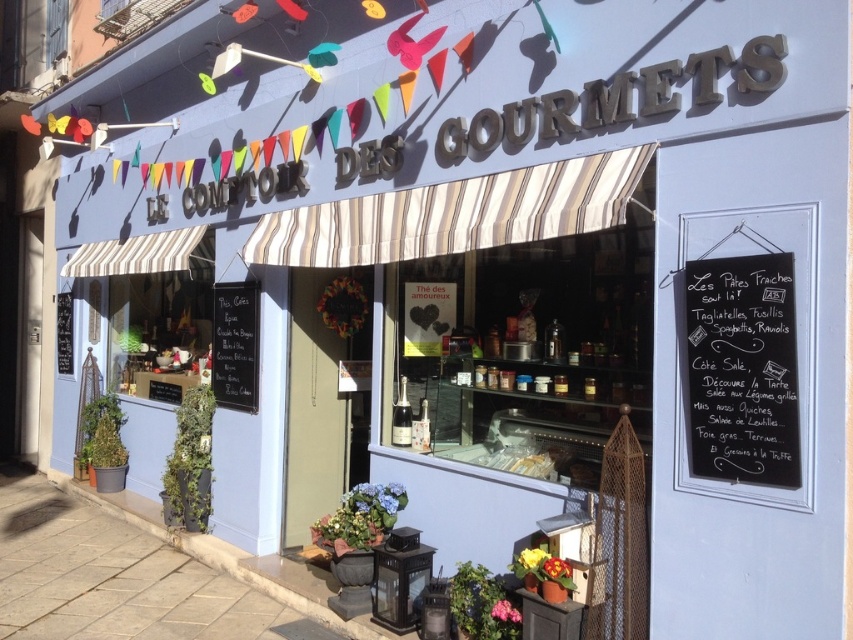
Is point (146, 563) closer to camera compared to point (723, 474)?

No, (146, 563) is further to viewer.

Which is more to the left, sandy beige paving stone at lower left or black chalkboard at upper right?

sandy beige paving stone at lower left is more to the left.

Between point (113, 605) and point (743, 284), which one is positioned behind?

Positioned behind is point (113, 605).

This screenshot has height=640, width=853. I want to click on sandy beige paving stone at lower left, so click(115, 579).